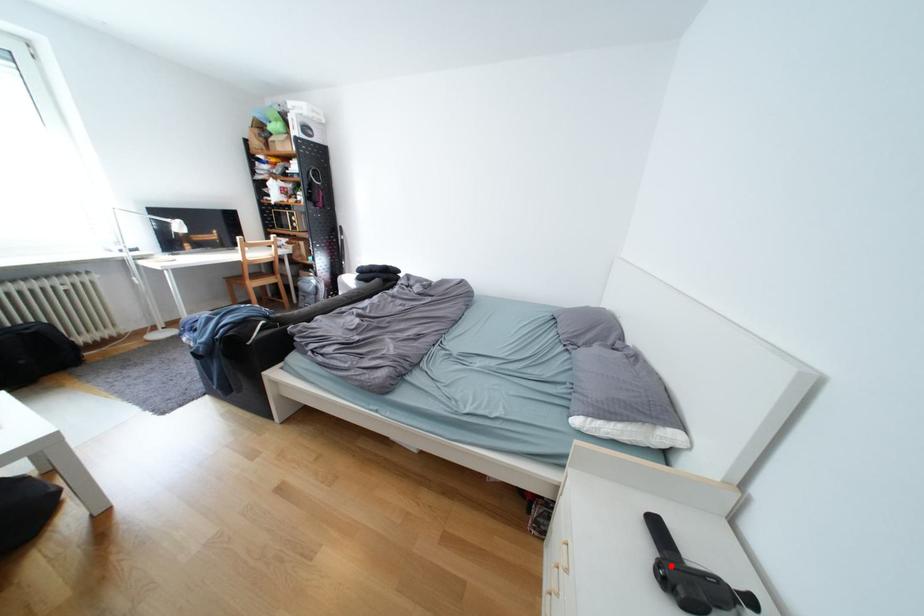
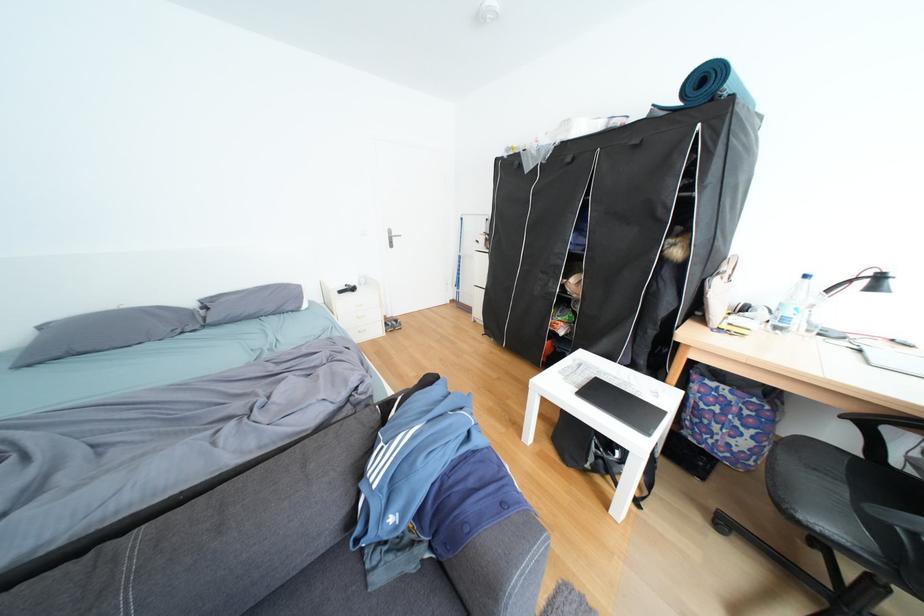
Question: I am providing you with two images of the same scene from different viewpoints. A red point is marked on the first image. Can you still see the location of the red point in image 2?

Choices:
 (A) Yes
 (B) No

Answer: (B)